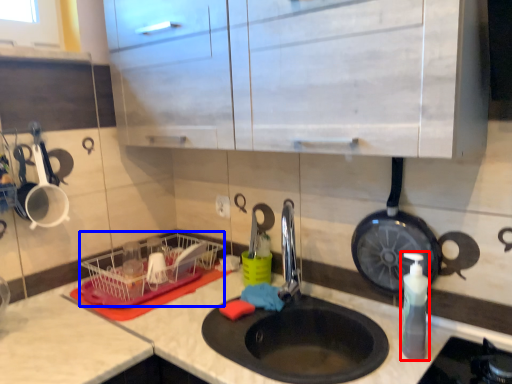
Question: Which point is closer to the camera, soap dispenser (highlighted by a red box) or basket (highlighted by a blue box)?

Choices:
 (A) soap dispenser
 (B) basket

Answer: (A)